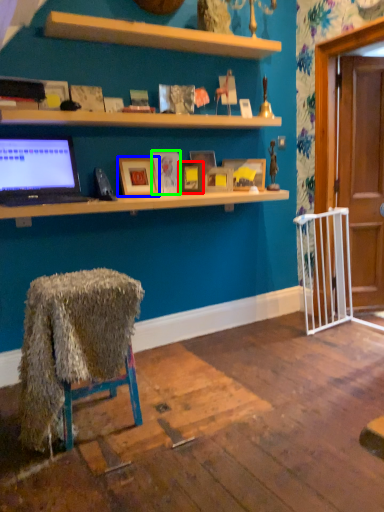
Question: Considering the real-world distances, which object is farthest from picture frame (highlighted by a red box)? picture frame (highlighted by a blue box) or picture frame (highlighted by a green box)?

Choices:
 (A) picture frame
 (B) picture frame

Answer: (A)